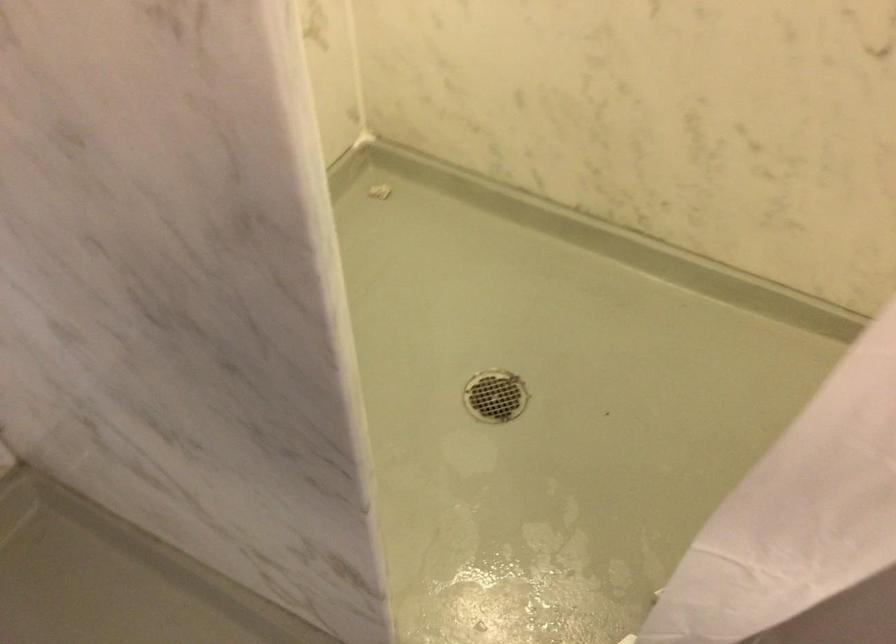
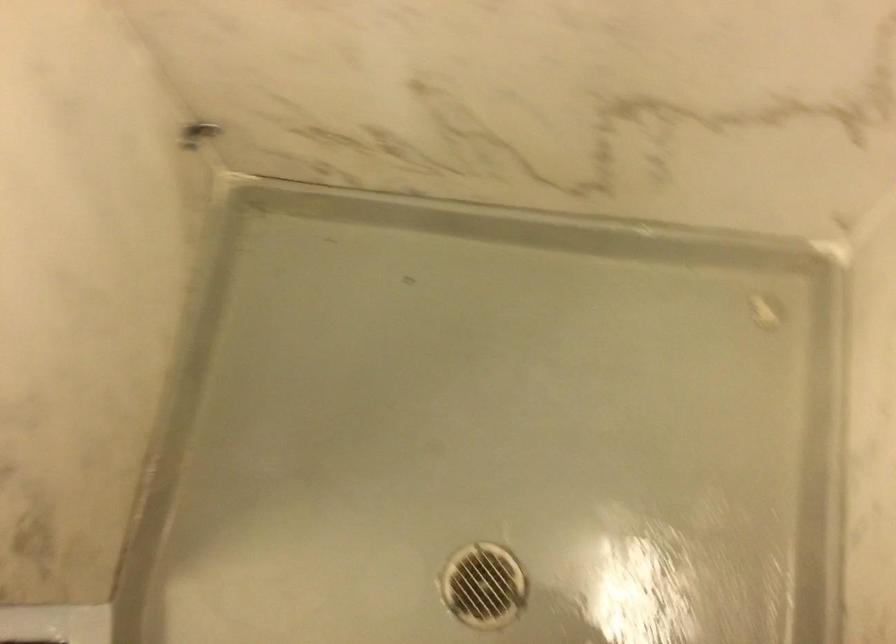
The first image is from the beginning of the video and the second image is from the end. How did the camera likely rotate when shooting the video?

The camera rotated toward left-down.